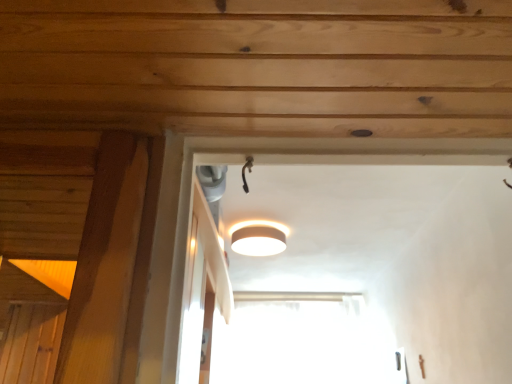
What do you see at coordinates (258, 238) in the screenshot? I see `white matte lamp at upper center` at bounding box center [258, 238].

The width and height of the screenshot is (512, 384). Identify the location of white matte lamp at upper center. (258, 238).

The height and width of the screenshot is (384, 512). I want to click on transparent glass window at center, so click(x=303, y=341).

Image resolution: width=512 pixels, height=384 pixels. Describe the element at coordinates (303, 341) in the screenshot. I see `transparent glass window at center` at that location.

Identify the location of white matte lamp at upper center. This screenshot has width=512, height=384. [x=258, y=238].

In the image, is white matte lamp at upper center on the left side or the right side of transparent glass window at center?

In the image, white matte lamp at upper center appears on the left side of transparent glass window at center.

Who is more distant, white matte lamp at upper center or transparent glass window at center?

transparent glass window at center is further from the camera.

Which is behind, point (284, 228) or point (259, 306)?

The point (259, 306) is more distant.

From the image's perspective, would you say white matte lamp at upper center is positioned over transparent glass window at center?

Yes, from the image's perspective, white matte lamp at upper center is on top of transparent glass window at center.

From a real-world perspective, who is located lower, white matte lamp at upper center or transparent glass window at center?

transparent glass window at center is physically lower.

Considering the sizes of objects white matte lamp at upper center and transparent glass window at center in the image provided, who is wider, white matte lamp at upper center or transparent glass window at center?

white matte lamp at upper center is wider.

Is white matte lamp at upper center taller than transparent glass window at center?

In fact, white matte lamp at upper center may be shorter than transparent glass window at center.

In the scene shown: Considering the sizes of objects white matte lamp at upper center and transparent glass window at center in the image provided, who is bigger, white matte lamp at upper center or transparent glass window at center?

transparent glass window at center is bigger.

Consider the image. Is transparent glass window at center located within white matte lamp at upper center?

No, transparent glass window at center is not a part of white matte lamp at upper center.

Is white matte lamp at upper center in contact with transparent glass window at center?

No, white matte lamp at upper center is not making contact with transparent glass window at center.

Could you tell me if white matte lamp at upper center is facing transparent glass window at center?

No, white matte lamp at upper center does not turn towards transparent glass window at center.

Locate an element on the screen. Image resolution: width=512 pixels, height=384 pixels. window that appears below the white matte lamp at upper center (from a real-world perspective) is located at coordinates (303, 341).

Between transparent glass window at center and white matte lamp at upper center, which one appears on the right side from the viewer's perspective?

From the viewer's perspective, transparent glass window at center appears more on the right side.

Is transparent glass window at center positioned behind white matte lamp at upper center?

Yes, transparent glass window at center is further from the viewer.

Does point (344, 320) appear closer or farther from the camera than point (234, 229)?

Point (344, 320) appears to be farther away from the viewer than point (234, 229).

From the image's perspective, is transparent glass window at center on white matte lamp at upper center?

No, from the image's perspective, transparent glass window at center is not over white matte lamp at upper center.

From a real-world perspective, is transparent glass window at center positioned over white matte lamp at upper center based on gravity?

No.

Which of these two, transparent glass window at center or white matte lamp at upper center, is wider?

With larger width is white matte lamp at upper center.

Between transparent glass window at center and white matte lamp at upper center, which one has less height?

With less height is white matte lamp at upper center.

Based on the photo, can you confirm if transparent glass window at center is smaller than white matte lamp at upper center?

No, transparent glass window at center is not smaller than white matte lamp at upper center.

Would you say transparent glass window at center is outside white matte lamp at upper center?

Yes, transparent glass window at center is located beyond the bounds of white matte lamp at upper center.

Is there a large distance between transparent glass window at center and white matte lamp at upper center?

Yes.

Is transparent glass window at center oriented away from white matte lamp at upper center?

No, transparent glass window at center is not facing the opposite direction of white matte lamp at upper center.

How distant is transparent glass window at center from white matte lamp at upper center?

They are 4.49 feet apart.

In the image, there is a transparent glass window at center. In order to click on lamp above it (from the image's perspective) in this screenshot , I will do `click(258, 238)`.

Identify the location of window below the white matte lamp at upper center (from the image's perspective). (303, 341).

The image size is (512, 384). Find the location of `lamp in front of the transparent glass window at center`. lamp in front of the transparent glass window at center is located at coordinates (258, 238).